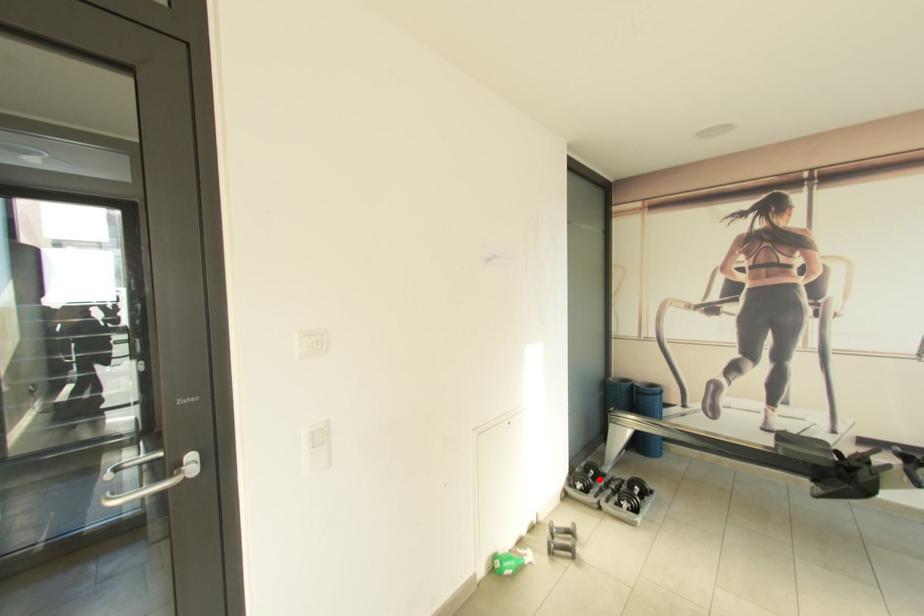
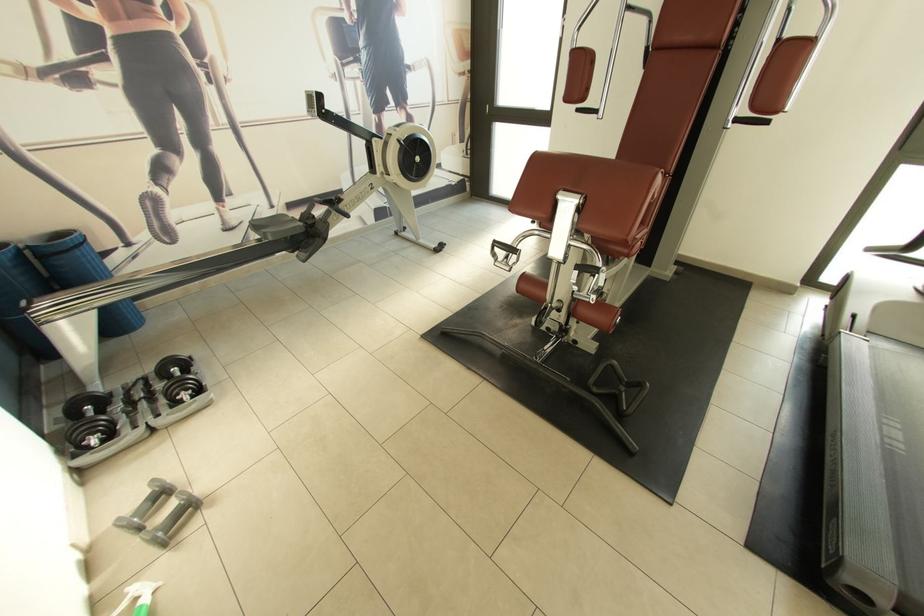
Find the pixel in the second image that matches the highlighted location in the first image.

(106, 413)